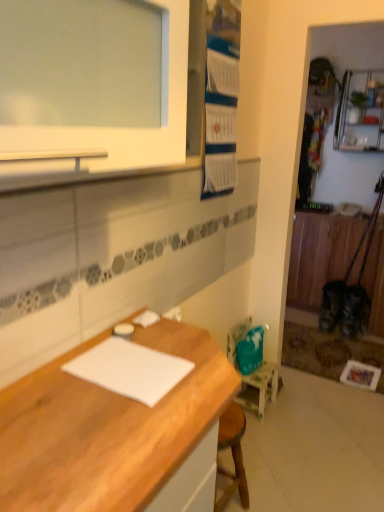
Question: From a real-world perspective, is teal fabric chair at lower right located higher than white paper at center?

Choices:
 (A) no
 (B) yes

Answer: (A)

Question: Is teal fabric chair at lower right oriented towards white paper at center?

Choices:
 (A) no
 (B) yes

Answer: (A)

Question: Does teal fabric chair at lower right have a greater height compared to white paper at center?

Choices:
 (A) no
 (B) yes

Answer: (B)

Question: Considering the relative sizes of teal fabric chair at lower right and white paper at center in the image provided, is teal fabric chair at lower right shorter than white paper at center?

Choices:
 (A) yes
 (B) no

Answer: (B)

Question: Considering the relative sizes of teal fabric chair at lower right and white paper at center in the image provided, is teal fabric chair at lower right bigger than white paper at center?

Choices:
 (A) no
 (B) yes

Answer: (B)

Question: From the image's perspective, relative to wooden desk at lower left, is teal fabric chair at lower right above or below?

Choices:
 (A) below
 (B) above

Answer: (B)

Question: In terms of width, does teal fabric chair at lower right look wider or thinner when compared to wooden desk at lower left?

Choices:
 (A) thin
 (B) wide

Answer: (A)

Question: Considering the positions of teal fabric chair at lower right and wooden desk at lower left in the image, is teal fabric chair at lower right taller or shorter than wooden desk at lower left?

Choices:
 (A) tall
 (B) short

Answer: (B)

Question: Considering the positions of teal fabric chair at lower right and wooden desk at lower left in the image, is teal fabric chair at lower right bigger or smaller than wooden desk at lower left?

Choices:
 (A) big
 (B) small

Answer: (B)

Question: Is point (377, 96) closer or farther from the camera than point (269, 393)?

Choices:
 (A) farther
 (B) closer

Answer: (A)

Question: Is metallic silver shelf at upper right in front of or behind teal fabric chair at lower right in the image?

Choices:
 (A) front
 (B) behind

Answer: (B)

Question: From the image's perspective, relative to teal fabric chair at lower right, is metallic silver shelf at upper right above or below?

Choices:
 (A) below
 (B) above

Answer: (B)

Question: In terms of width, does metallic silver shelf at upper right look wider or thinner when compared to teal fabric chair at lower right?

Choices:
 (A) wide
 (B) thin

Answer: (A)

Question: From the image's perspective, is teal fabric chair at lower right positioned above or below white paper at center?

Choices:
 (A) above
 (B) below

Answer: (B)

Question: Is point (233, 365) closer or farther from the camera than point (178, 371)?

Choices:
 (A) closer
 (B) farther

Answer: (B)